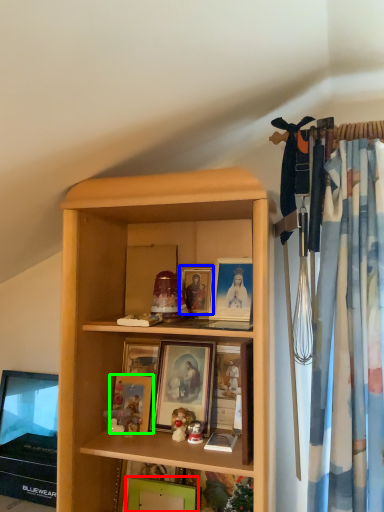
Question: Considering the real-world distances, which object is closest to picture frame (highlighted by a red box)? picture frame (highlighted by a blue box) or picture frame (highlighted by a green box).

Choices:
 (A) picture frame
 (B) picture frame

Answer: (B)